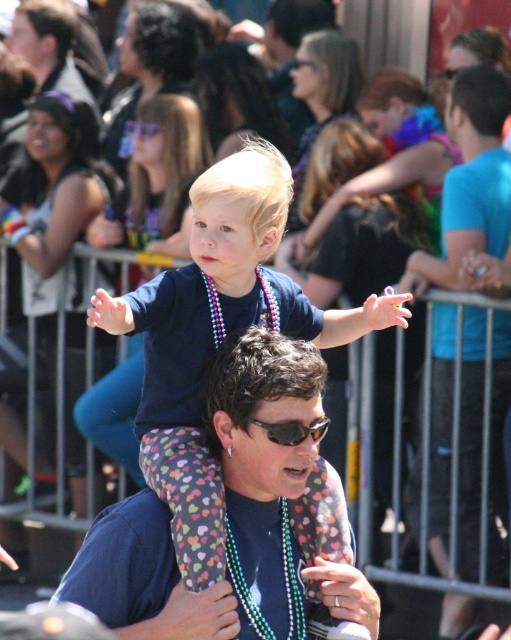
Question: Is the position of dark blue shirt at center more distant than that of blue t-shirt at center?

Choices:
 (A) no
 (B) yes

Answer: (A)

Question: Which is nearer to the blue t-shirt at center?

Choices:
 (A) sunglasses at center
 (B) dark blue shirt at center

Answer: (A)

Question: Is blue t-shirt at center to the left of sunglasses at center from the viewer's perspective?

Choices:
 (A) yes
 (B) no

Answer: (B)

Question: Which of the following is the closest to the observer?

Choices:
 (A) sunglasses at center
 (B) dark blue shirt at center

Answer: (B)

Question: Does dark blue shirt at center appear on the right side of blue t-shirt at center?

Choices:
 (A) yes
 (B) no

Answer: (B)

Question: Which of the following is the farthest from the observer?

Choices:
 (A) dark blue shirt at center
 (B) sunglasses at center

Answer: (B)